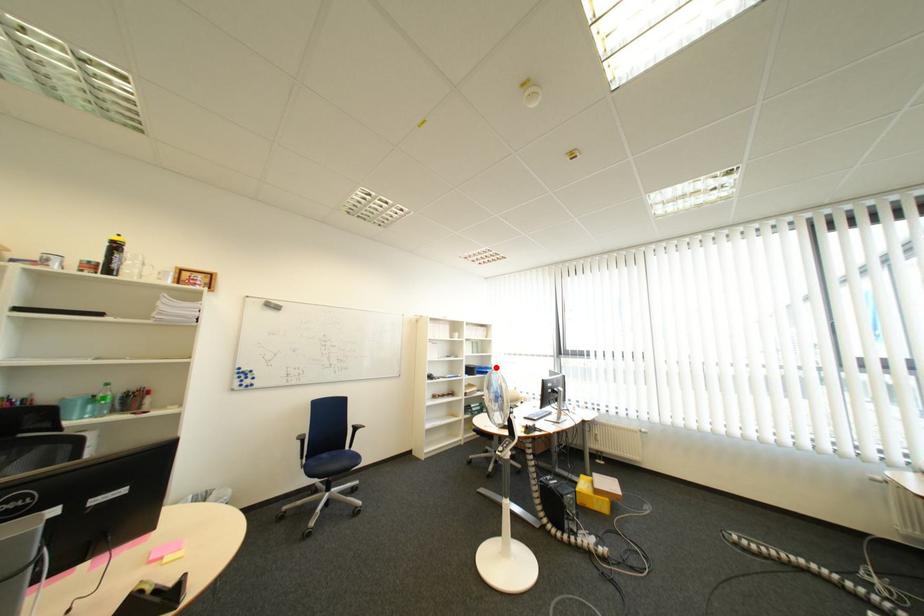
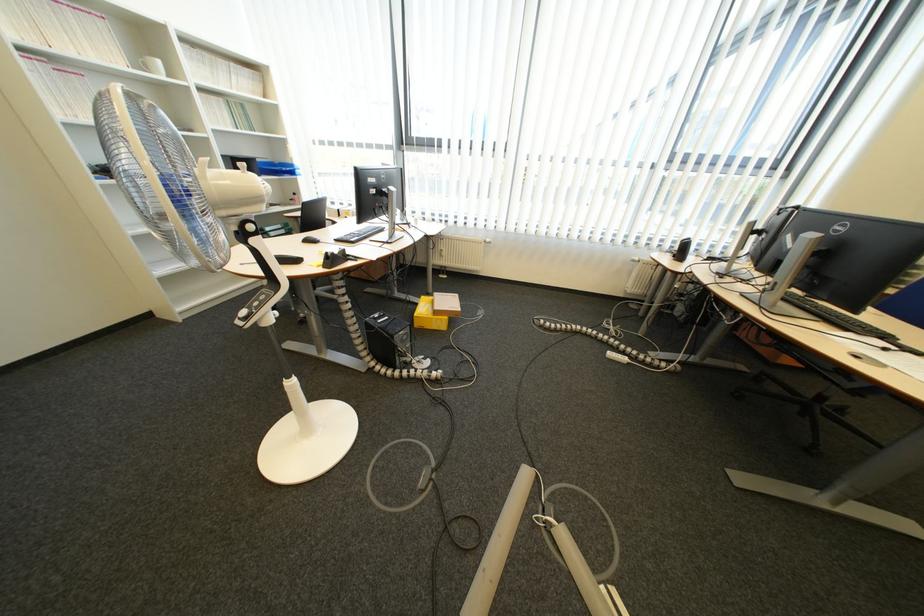
In the second image, find the point that corresponds to the highlighted location in the first image.

(289, 163)